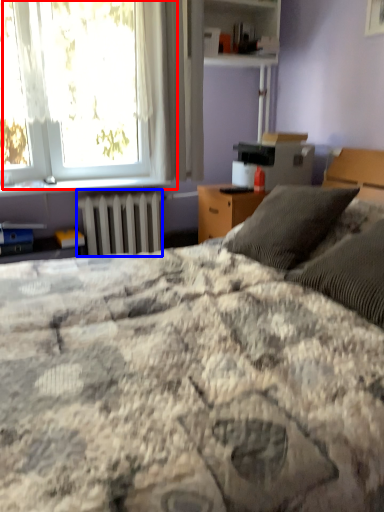
Question: Which object is closer to the camera taking this photo, window (highlighted by a red box) or radiator (highlighted by a blue box)?

Choices:
 (A) window
 (B) radiator

Answer: (A)